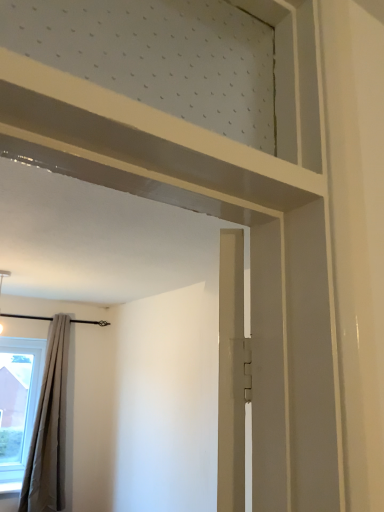
Image resolution: width=384 pixels, height=512 pixels. What do you see at coordinates (49, 428) in the screenshot? I see `beige fabric curtain at left` at bounding box center [49, 428].

What is the approximate width of beige fabric curtain at left?

beige fabric curtain at left is 7.85 inches in width.

At what (x,y) coordinates should I click in order to perform the action: click on beige fabric curtain at left. Please return your answer as a coordinate pair (x, y). This screenshot has width=384, height=512. Looking at the image, I should click on (49, 428).

Where is `beige fabric curtain at left`? beige fabric curtain at left is located at coordinates (49, 428).